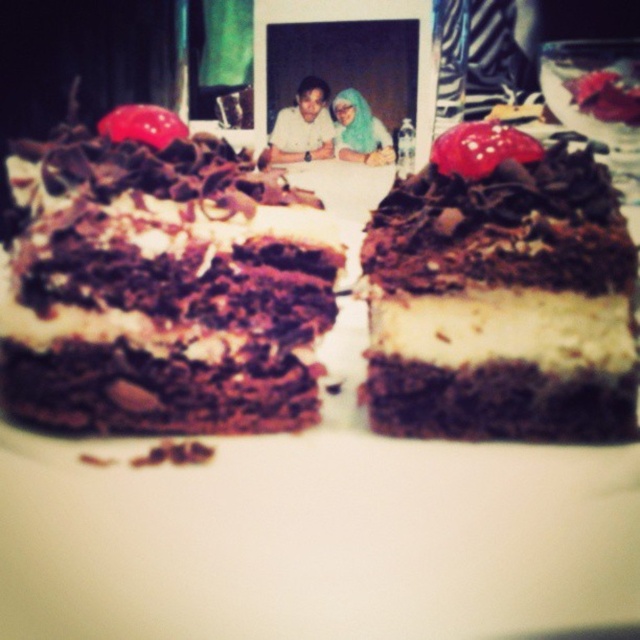
You are a photographer trying to capture the chocolatecrumblycake at center and the blue fabric headscarf at upper center in the same frame. Based on their sizes, which object should you focus on first to ensure both are in focus?

The chocolatecrumblycake at center is taller than the blue fabric headscarf at upper center, so you should focus on the chocolatecrumblycake at center first to ensure both are in focus.

You are a customer at a cafe and see the chocolatecrumblycake at center and the blue fabric headscarf at upper center. Which object is closer to the left side of the image?

The chocolatecrumblycake at center is closer to the left side of the image because it is positioned to the left of the blue fabric headscarf at upper center.

You are a photographer setting up a shoot in the scene. You need to position a light source to illuminate both the matte white shirt at center and the blue fabric headscarf at upper center equally. Considering their widths, which object requires the light to be placed closer to it to ensure proper illumination?

The blue fabric headscarf at upper center requires the light source to be placed closer because it is narrower than the matte white shirt at center, which has a greater width. A narrower object typically needs the light source closer to achieve even illumination compared to a wider object.